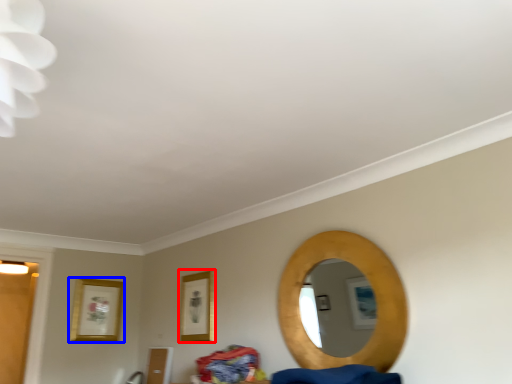
Question: Which object appears farthest to the camera in this image, picture frame (highlighted by a red box) or picture frame (highlighted by a blue box)?

Choices:
 (A) picture frame
 (B) picture frame

Answer: (B)